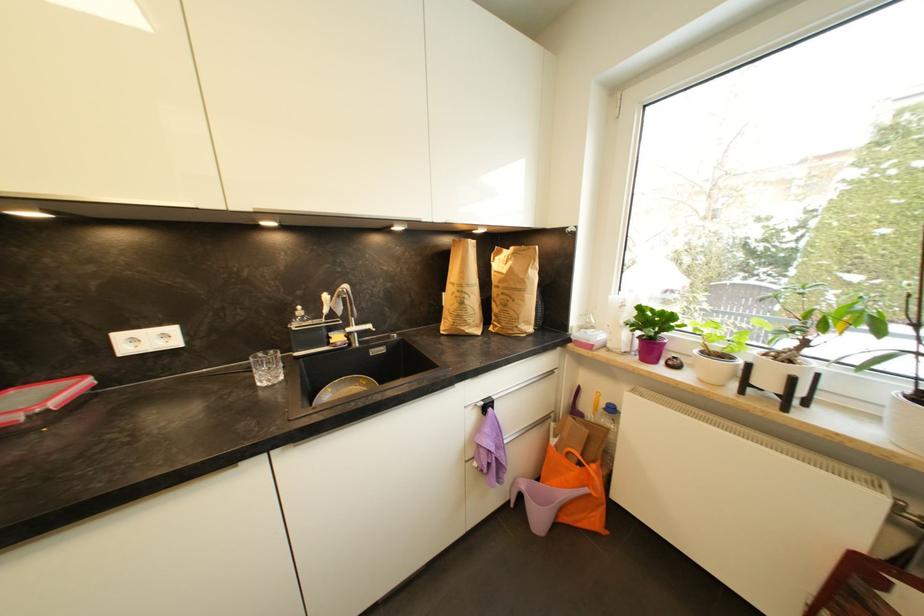
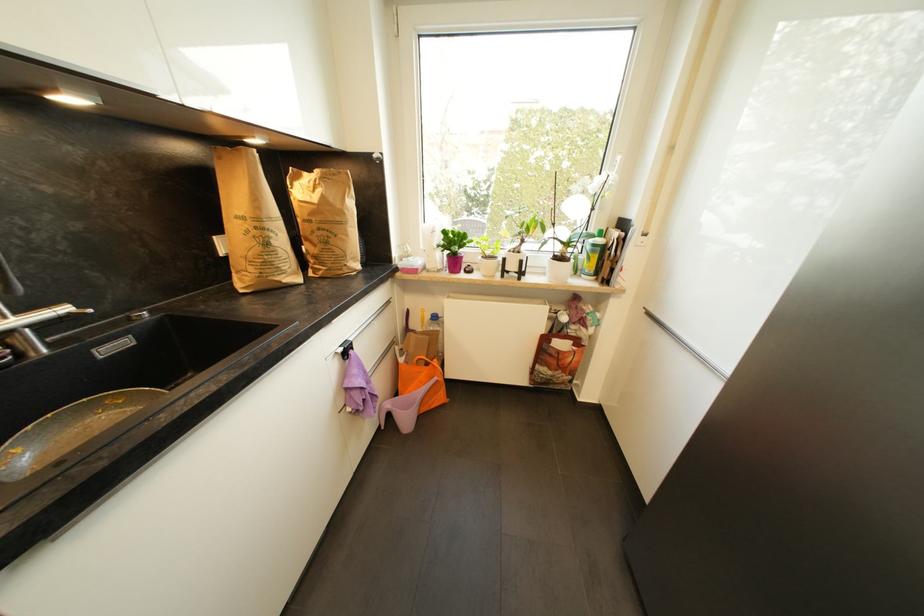
The images are taken continuously from a first-person perspective. In which direction is your viewpoint rotating?

The rotation direction of the camera is right-down.